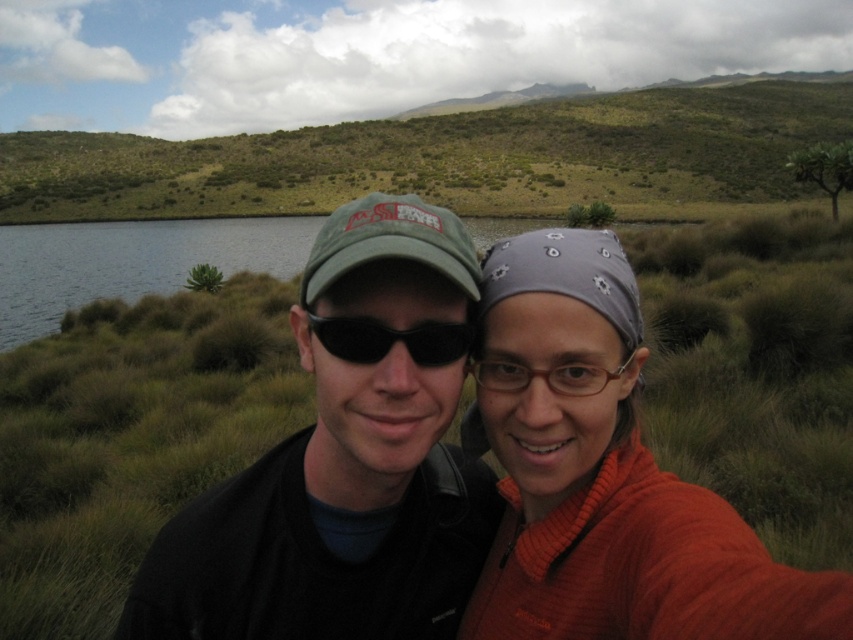
Who is shorter, green grassy hill at upper center or clear water at lake left?

clear water at lake left

Locate an element on the screen. The image size is (853, 640). green grassy hill at upper center is located at coordinates (447, 157).

Where is `green grassy hill at upper center`? green grassy hill at upper center is located at coordinates (447, 157).

Is green grassy hill at upper center above black plastic sunglasses at center?

Indeed, green grassy hill at upper center is positioned over black plastic sunglasses at center.

Can you confirm if green grassy hill at upper center is thinner than black plastic sunglasses at center?

No, green grassy hill at upper center is not thinner than black plastic sunglasses at center.

Between point (451, 204) and point (351, 324), which one is positioned behind?

Positioned behind is point (451, 204).

In order to click on green grassy hill at upper center in this screenshot , I will do `click(447, 157)`.

Can you confirm if clear water at lake left is shorter than black plastic sunglasses at center?

Incorrect, clear water at lake left's height does not fall short of black plastic sunglasses at center's.

In the scene shown: Does clear water at lake left appear under black plastic sunglasses at center?

No, clear water at lake left is not below black plastic sunglasses at center.

Which is in front, point (250, 241) or point (343, 330)?

Point (343, 330)

At what (x,y) coordinates should I click in order to perform the action: click on clear water at lake left. Please return your answer as a coordinate pair (x, y). The image size is (853, 640). Looking at the image, I should click on (131, 262).